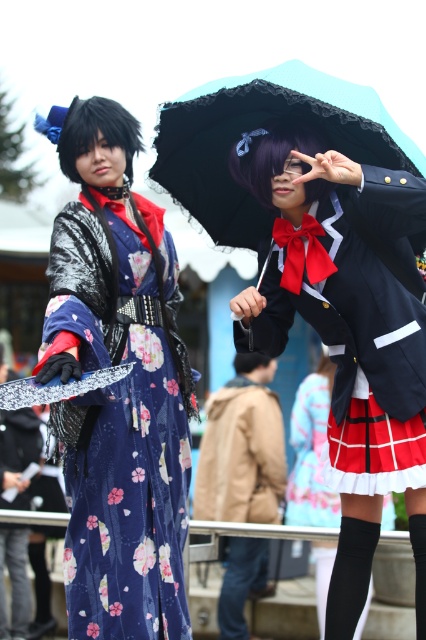
You are a photographer setting up for a photoshoot. You need to ensure that the matte black umbrella at upper center and the floral silk kimono at center are both visible in the frame. Given their sizes, which object might require you to adjust your camera angle to accommodate its width?

The matte black umbrella at upper center has a larger width than the floral silk kimono at center, so it might require adjusting the camera angle to ensure it fits within the frame.

You are standing in the middle of the image and want to locate the matte black umbrella at upper center. Which direction should you look to find it?

You should look upward because the matte black umbrella at upper center is located at point (348, 333), which is in the upper part of the image.

You are a photographer at a cosplay event and need to arrange the two main characters so that their outfits are clearly visible. The floral silk kimono at center belongs to the person on the left, and the black lace umbrella at upper center is held by the person on the right. Since the kimono is thinner than the umbrella, which outfit detail should you focus on to ensure it doesn not get lost in the background?

The floral silk kimono at center is thinner than the black lace umbrella at upper center, so you should focus on the kimono to ensure its details are highlighted and do not get lost against the background.